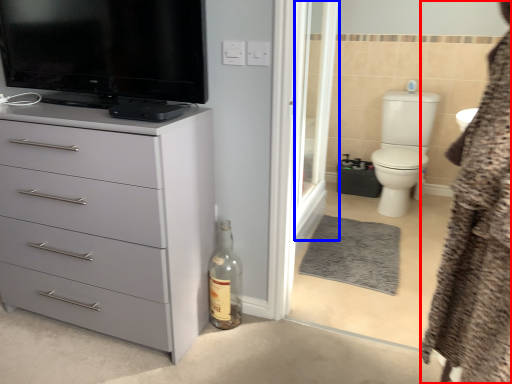
Question: Among these objects, which one is nearest to the camera, bathrobe (highlighted by a red box) or screen door (highlighted by a blue box)?

Choices:
 (A) bathrobe
 (B) screen door

Answer: (A)